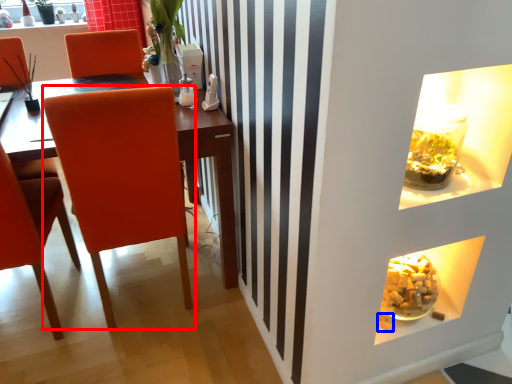
Question: Which object appears farthest to the camera in this image, chair (highlighted by a red box) or food (highlighted by a blue box)?

Choices:
 (A) chair
 (B) food

Answer: (B)